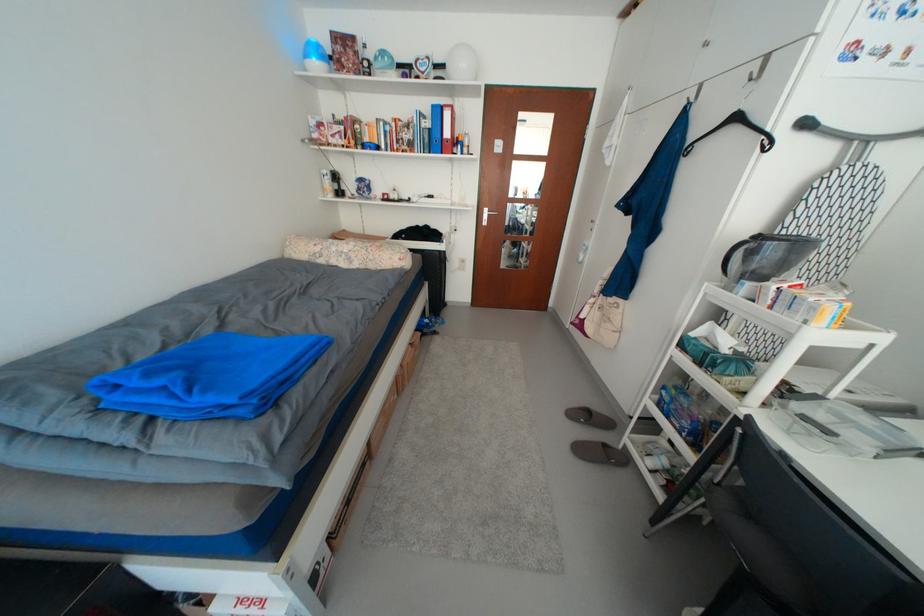
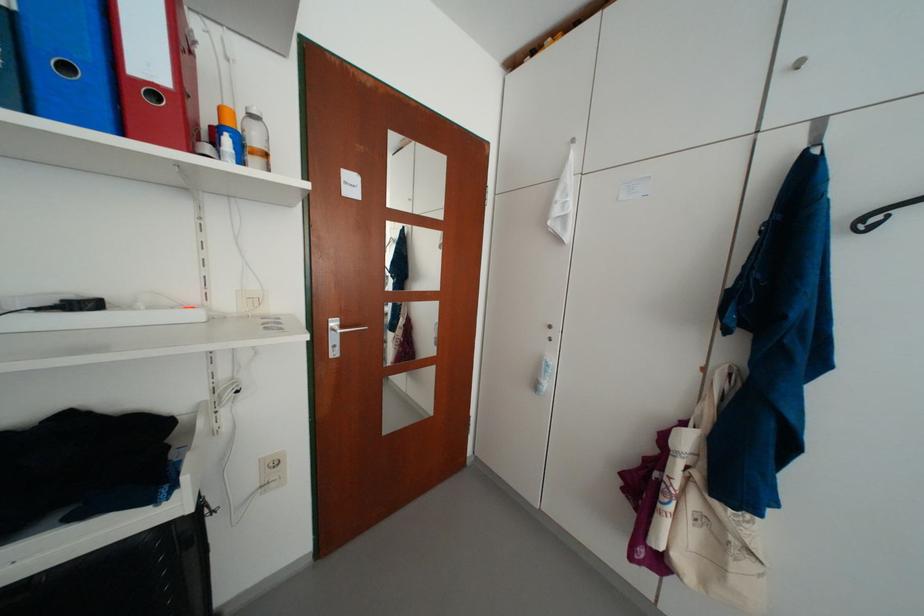
Where in the second image is the point corresponding to point (465, 201) from the first image?

(236, 306)